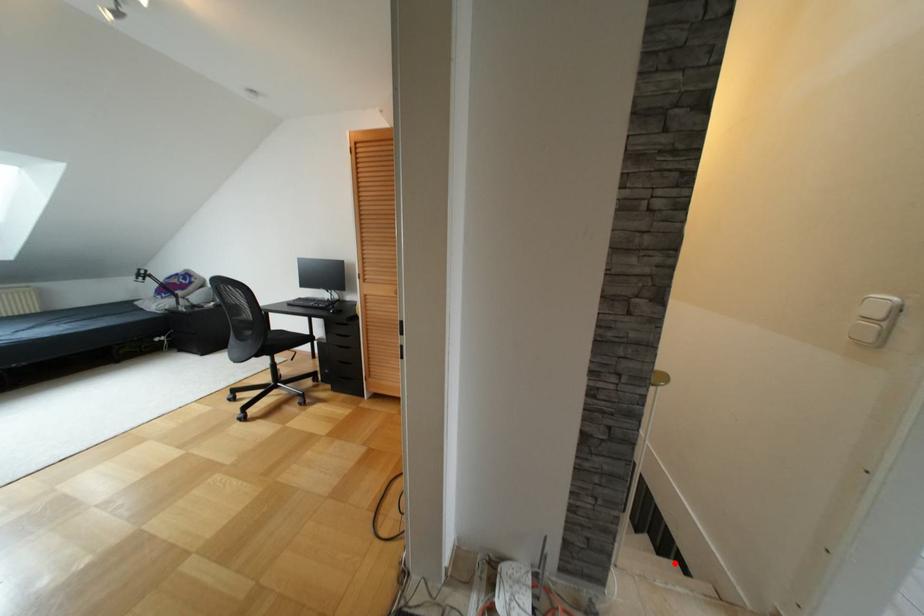
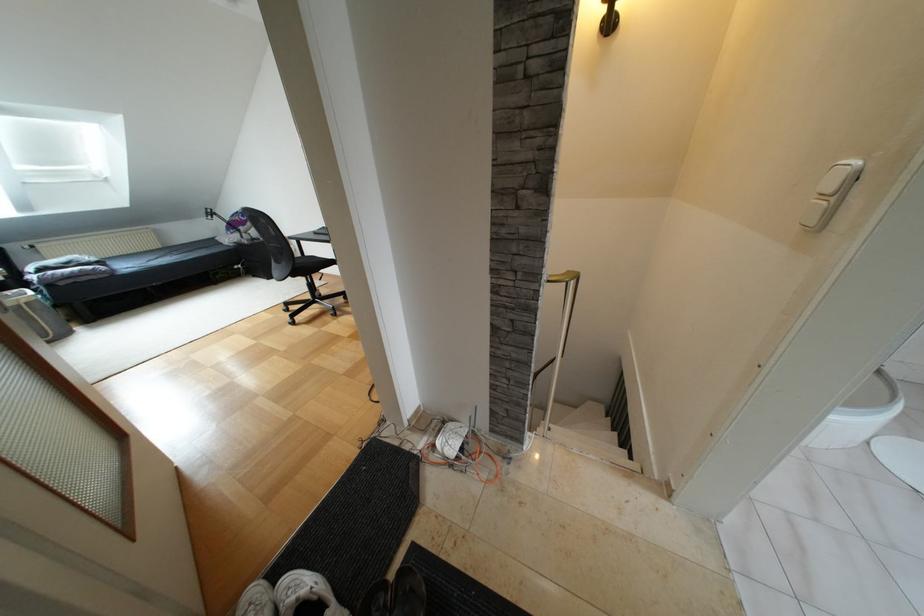
Where in the second image is the point corresponding to the highlighted location from the first image?

(624, 451)